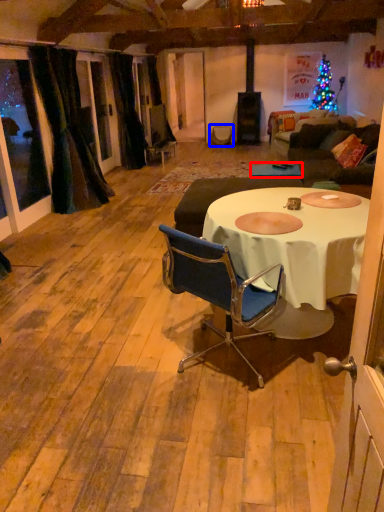
Question: Among these objects, which one is farthest to the camera, table (highlighted by a red box) or armchair (highlighted by a blue box)?

Choices:
 (A) table
 (B) armchair

Answer: (B)